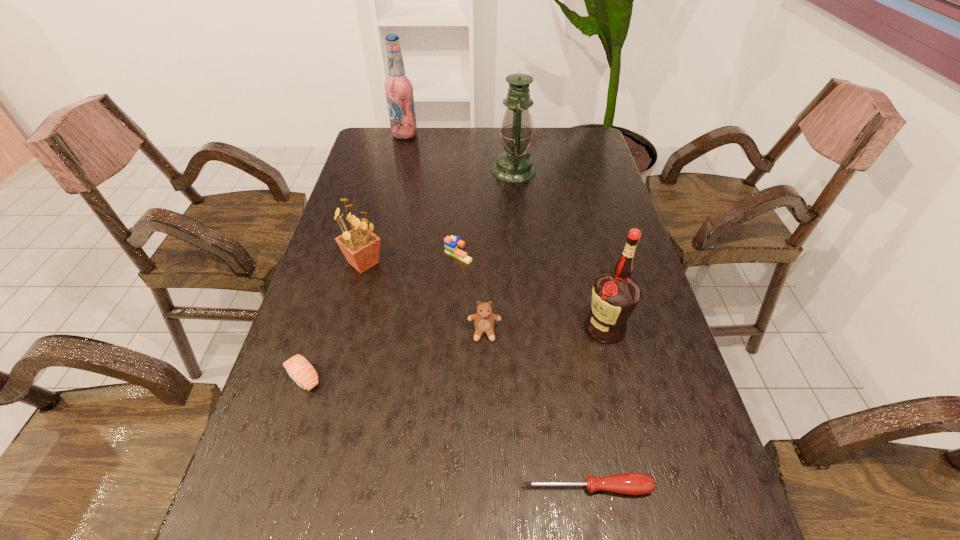
The width and height of the screenshot is (960, 540). What are the coordinates of `the farther alcohol` in the screenshot? It's located at (398, 88).

At what (x,y) coordinates should I click in order to perform the action: click on the left alcohol. Please return your answer as a coordinate pair (x, y). Looking at the image, I should click on (398, 88).

Identify the location of the second farthest object. The image size is (960, 540). (514, 165).

What are the coordinates of `the nearer alcohol` in the screenshot? It's located at (615, 294).

Locate an element on the screen. The image size is (960, 540). the right alcohol is located at coordinates (615, 294).

Identify the location of sunflower. (360, 246).

You are a GUI agent. You are given a task and a screenshot of the screen. Output one action in this format:
    pyautogui.click(x=<x>, y=<y>)
    Task: Click on the teddy bear
    
    Given the screenshot: What is the action you would take?
    pyautogui.click(x=484, y=320)

I want to click on Lego, so click(x=453, y=245).

Image resolution: width=960 pixels, height=540 pixels. I want to click on the second nearest object, so click(299, 369).

The image size is (960, 540). What are the coordinates of `the nearest object` in the screenshot? It's located at (628, 483).